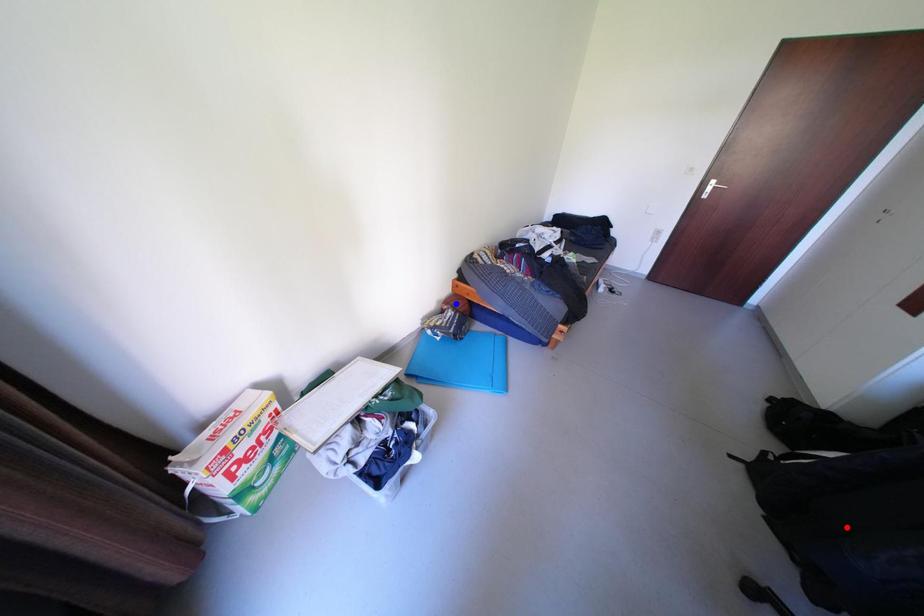
Question: Which of the two points in the image is closer to the camera?

Choices:
 (A) Blue point is closer.
 (B) Red point is closer.

Answer: (B)